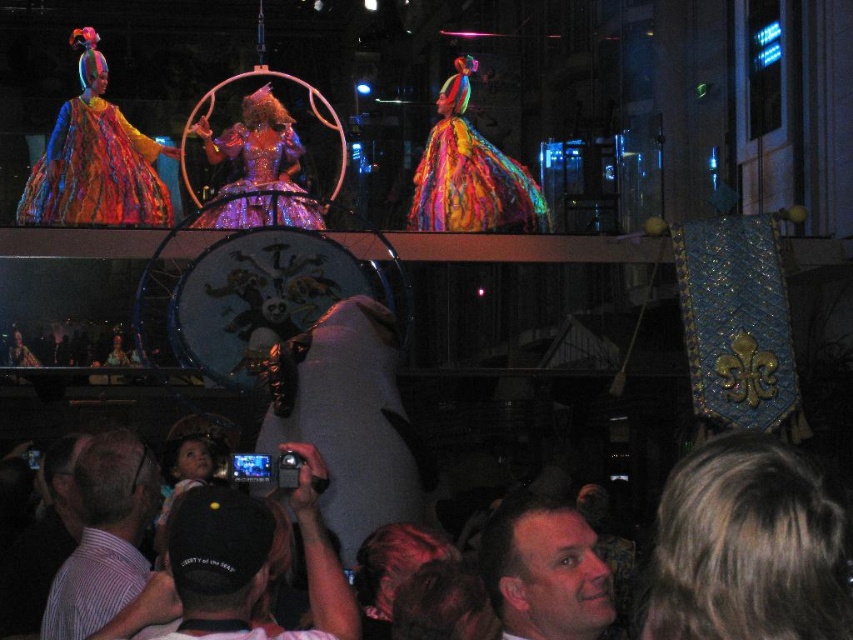
Consider the image. You are a photographer at the circus performance. You want to take a photo of both the multicolored sequined dress at center and the shiny sequined dress at center. The camera you are using has a maximum focus range of 15 meters. Can you capture both dresses in focus at the same time?

The multicolored sequined dress at center is 19.41 meters away from the shiny sequined dress at center. Since the distance between them exceeds the camera maximum focus range of 15 meters, you cannot capture both dresses in focus at the same time.

You are a photographer in the audience at the circus performance. You notice two sequined dresses at the center of the stage. Which dress is positioned higher up between the multicolored sequined dress at center and the shiny sequined dress at center?

The multicolored sequined dress at center is positioned higher up compared to the shiny sequined dress at center.